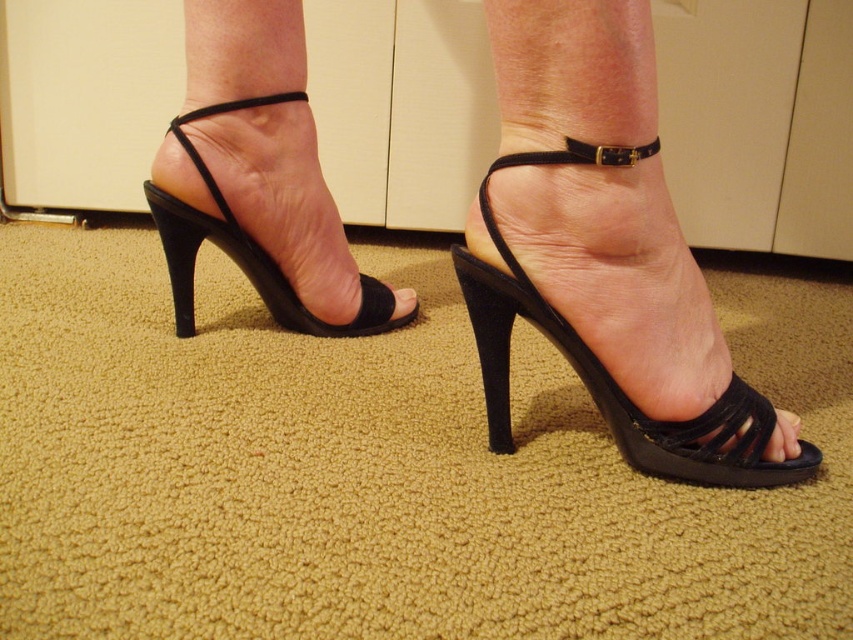
Which is behind, point (595, 284) or point (312, 323)?

The point (312, 323) is more distant.

Can you confirm if suede black high-heeled sandals at center is taller than suede black high-heeled sandal at left?

Yes, suede black high-heeled sandals at center is taller than suede black high-heeled sandal at left.

Does point (492, 252) lie in front of point (254, 259)?

That is True.

Image resolution: width=853 pixels, height=640 pixels. Identify the location of suede black high-heeled sandals at center. (605, 253).

This screenshot has height=640, width=853. Describe the element at coordinates (607, 371) in the screenshot. I see `suede black sandal at center` at that location.

Is suede black sandal at center wider than suede black high-heeled sandal at left?

Yes.

What do you see at coordinates (607, 371) in the screenshot?
I see `suede black sandal at center` at bounding box center [607, 371].

Locate an element on the screen. The image size is (853, 640). suede black sandal at center is located at coordinates (x=607, y=371).

Is suede black high-heeled sandals at center positioned in front of suede black sandal at center?

Yes, suede black high-heeled sandals at center is in front of suede black sandal at center.

Consider the image. Does suede black high-heeled sandals at center have a greater width compared to suede black sandal at center?

Incorrect, suede black high-heeled sandals at center's width does not surpass suede black sandal at center's.

This screenshot has height=640, width=853. Find the location of `suede black high-heeled sandals at center`. suede black high-heeled sandals at center is located at coordinates (605, 253).